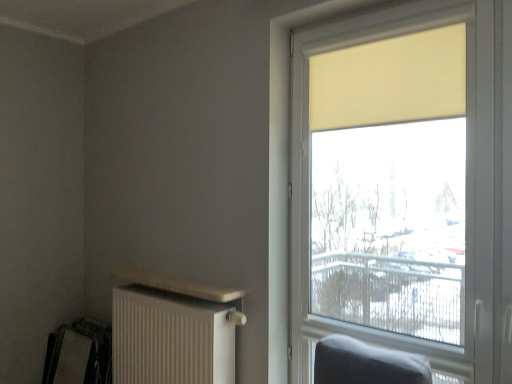
Question: Is matte yellow roller shade at right wider or thinner than white textured radiator at lower left?

Choices:
 (A) wide
 (B) thin

Answer: (B)

Question: From their relative heights in the image, would you say matte yellow roller shade at right is taller or shorter than white textured radiator at lower left?

Choices:
 (A) tall
 (B) short

Answer: (A)

Question: Which of these objects is positioned closest to the matte yellow roller shade at right?

Choices:
 (A) white textured radiator at lower left
 (B) beige fabric curtain at upper right
 (C) metallic silver swivel chair at lower left

Answer: (B)

Question: Estimate the real-world distances between objects in this image. Which object is closer to the beige fabric curtain at upper right?

Choices:
 (A) metallic silver swivel chair at lower left
 (B) matte yellow roller shade at right
 (C) white textured radiator at lower left

Answer: (B)